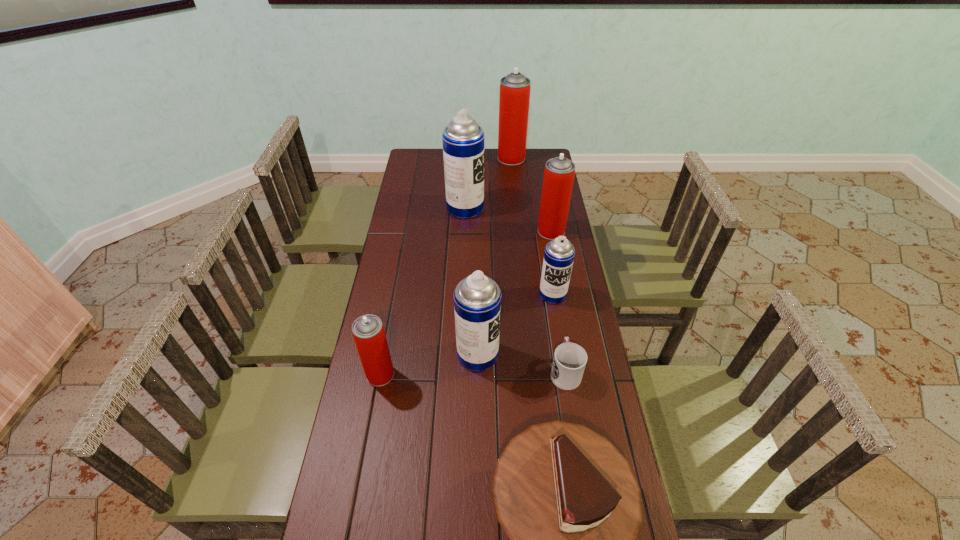
Identify the location of free space between the second red aerosol can from left to right and the second biggest blue aerosol can. (494, 256).

At what (x,y) coordinates should I click in order to perform the action: click on vacant area between the second farthest blue aerosol can and the nearest blue aerosol can. Please return your answer as a coordinate pair (x, y). This screenshot has width=960, height=540. Looking at the image, I should click on (516, 325).

You are a GUI agent. You are given a task and a screenshot of the screen. Output one action in this format:
    pyautogui.click(x=<x>, y=<y>)
    Task: Click on the free space between the smallest red aerosol can and the farthest aerosol can
    
    Given the screenshot: What is the action you would take?
    pyautogui.click(x=445, y=266)

The height and width of the screenshot is (540, 960). I want to click on empty space that is in between the farthest blue aerosol can and the biggest red aerosol can, so click(x=489, y=183).

Where is `object that is the fifth closest to the shortest object`? This screenshot has width=960, height=540. object that is the fifth closest to the shortest object is located at coordinates (559, 172).

You are a GUI agent. You are given a task and a screenshot of the screen. Output one action in this format:
    pyautogui.click(x=<x>, y=<y>)
    Task: Click on the object that is the seventh closest to the farthest aerosol can
    
    Given the screenshot: What is the action you would take?
    pyautogui.click(x=568, y=500)

Find the location of a particular element. aerosol can that can be found as the fifth closest to the second biggest blue aerosol can is located at coordinates (x=514, y=98).

Locate an element on the screen. This screenshot has width=960, height=540. the closest aerosol can to the rightmost blue aerosol can is located at coordinates (477, 298).

At what (x,y) coordinates should I click in order to perform the action: click on the closest blue aerosol can to the cake. Please return your answer as a coordinate pair (x, y). Looking at the image, I should click on (477, 298).

Find the location of a particular element. This screenshot has height=540, width=960. the second closest blue aerosol can to the farthest red aerosol can is located at coordinates (559, 253).